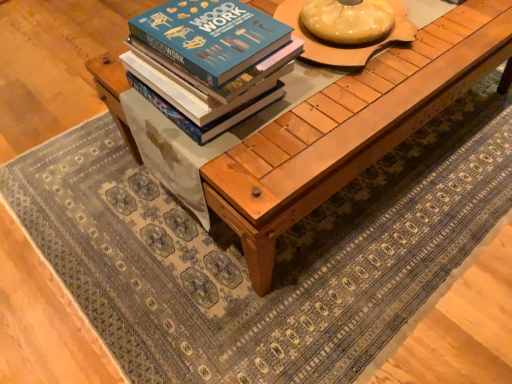
Question: Is natural wood table at center positioned beyond the bounds of blue matte book at center?

Choices:
 (A) no
 (B) yes

Answer: (B)

Question: Is natural wood table at center further to the viewer compared to blue matte book at center?

Choices:
 (A) no
 (B) yes

Answer: (B)

Question: Is natural wood table at center at the right side of blue matte book at center?

Choices:
 (A) no
 (B) yes

Answer: (B)

Question: Is natural wood table at center thinner than blue matte book at center?

Choices:
 (A) no
 (B) yes

Answer: (A)

Question: Would you consider natural wood table at center to be distant from blue matte book at center?

Choices:
 (A) no
 (B) yes

Answer: (A)

Question: In the image, is natural wood table at center positioned in front of or behind matte wooden round table at center?

Choices:
 (A) behind
 (B) front

Answer: (B)

Question: Is natural wood table at center to the left or to the right of matte wooden round table at center in the image?

Choices:
 (A) left
 (B) right

Answer: (B)

Question: From a real-world perspective, relative to matte wooden round table at center, is natural wood table at center vertically above or below?

Choices:
 (A) above
 (B) below

Answer: (B)

Question: Considering the positions of point (360, 168) and point (340, 56), is point (360, 168) closer or farther from the camera than point (340, 56)?

Choices:
 (A) closer
 (B) farther

Answer: (A)

Question: Based on their positions, is blue matte book at center located to the left or right of matte wooden round table at center?

Choices:
 (A) left
 (B) right

Answer: (A)

Question: Considering the positions of blue matte book at center and matte wooden round table at center in the image, is blue matte book at center taller or shorter than matte wooden round table at center?

Choices:
 (A) short
 (B) tall

Answer: (A)

Question: In the image, is blue matte book at center positioned in front of or behind matte wooden round table at center?

Choices:
 (A) front
 (B) behind

Answer: (A)

Question: From a real-world perspective, is blue matte book at center above or below matte wooden round table at center?

Choices:
 (A) below
 (B) above

Answer: (A)

Question: Is matte wooden round table at center wider or thinner than blue matte book at center?

Choices:
 (A) thin
 (B) wide

Answer: (B)

Question: Would you say matte wooden round table at center is to the left or to the right of blue matte book at center in the picture?

Choices:
 (A) left
 (B) right

Answer: (B)